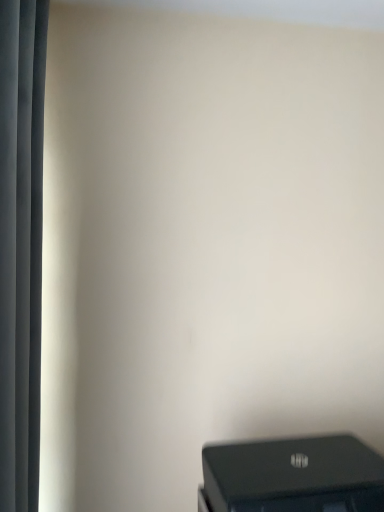
Question: Should I look upward or downward to see black plastic printer at lower right?

Choices:
 (A) up
 (B) down

Answer: (B)